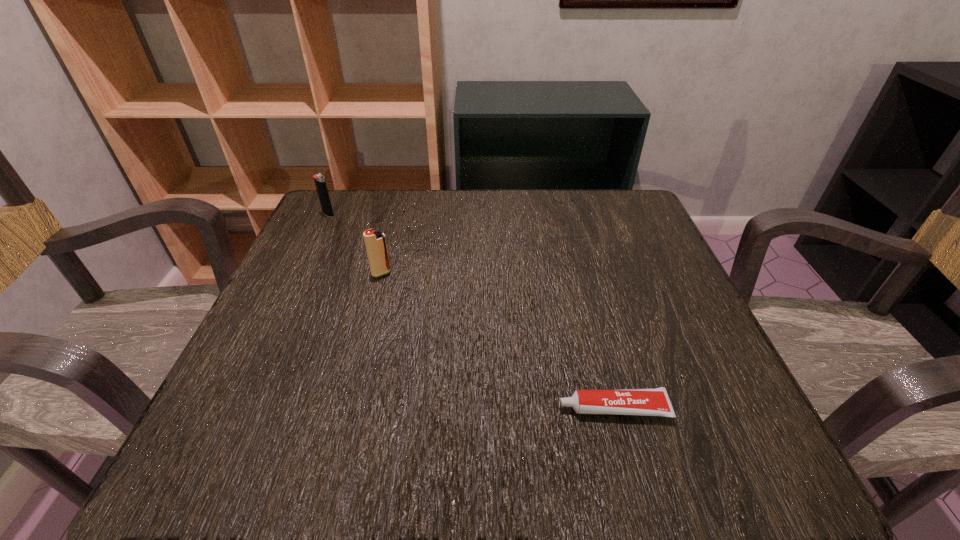
Where is `free spot between the right igniter and the leftmost object`? free spot between the right igniter and the leftmost object is located at coordinates (355, 244).

You are a GUI agent. You are given a task and a screenshot of the screen. Output one action in this format:
    pyautogui.click(x=<x>, y=<y>)
    Task: Click on the free space between the second farthest object and the shortest object
    
    Given the screenshot: What is the action you would take?
    pyautogui.click(x=497, y=341)

Identify the location of free point between the nearest object and the left igniter. (470, 312).

Find the location of a particular element. Image resolution: width=960 pixels, height=540 pixels. free spot between the right igniter and the toothpaste is located at coordinates 497,341.

The height and width of the screenshot is (540, 960). I want to click on object identified as the second closest to the right igniter, so click(647, 402).

I want to click on object that is the second closest one to the farther igniter, so click(647, 402).

This screenshot has width=960, height=540. In order to click on blank space that satisfies the following two spatial constraints: 1. on the front side of the right igniter; 2. on the left side of the left igniter in this screenshot , I will do `click(300, 273)`.